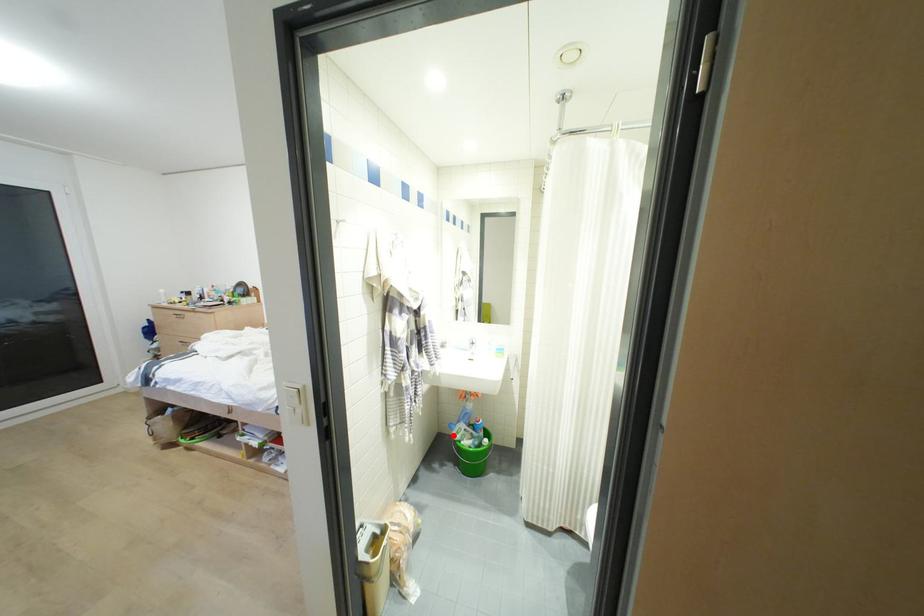
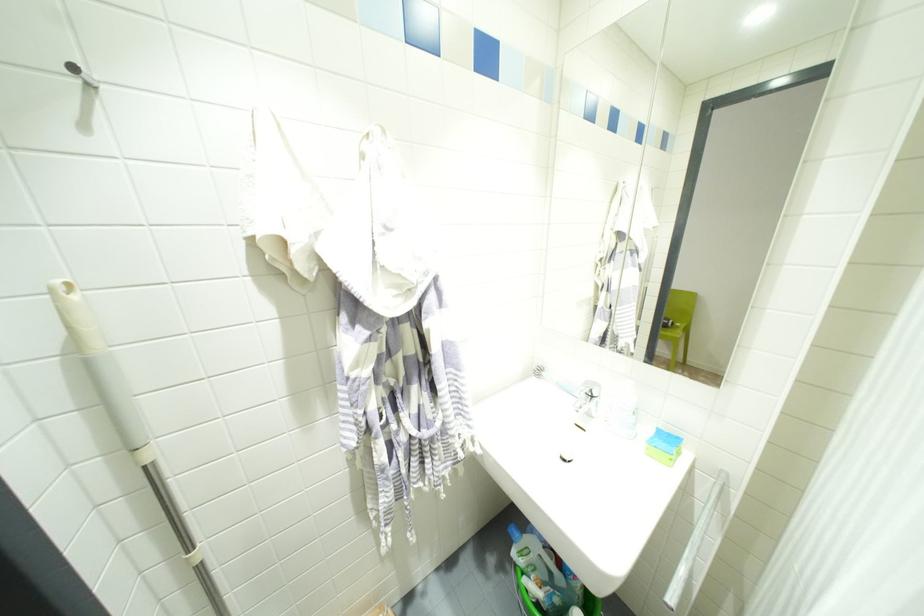
Where in the second image is the point corresponding to the highlighted location from the first image?

(513, 553)